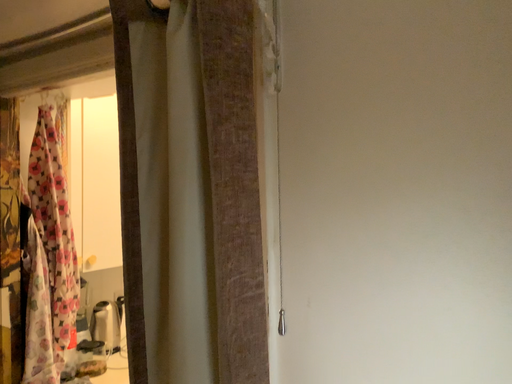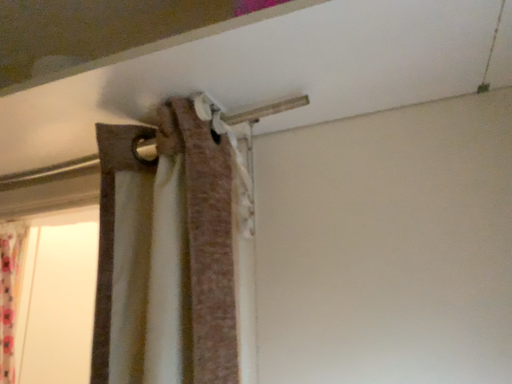
Question: Which way did the camera rotate in the video?

Choices:
 (A) rotated upward
 (B) rotated downward

Answer: (A)